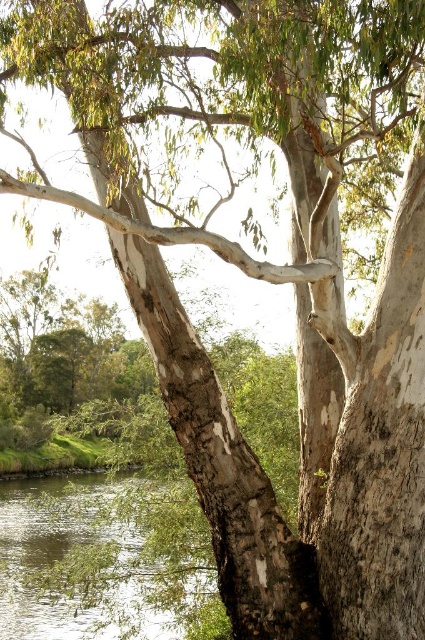
You are a hiker standing at the edge of the forest. You notice the white rough bark tree trunk at center and the clear water at lower left. Which object is taller?

The white rough bark tree trunk at center is taller than the clear water at lower left.

You are a painter setting up your easel to capture the scene of the white rough bark tree trunk at center and the clear water at lower left. You want to ensure the tree trunk is not wider than the water in your painting. Based on the scene, will you need to adjust the tree trunk width in your artwork?

The white rough bark tree trunk at center has a lesser width compared to clear water at lower left, so you do not need to adjust the tree trunk width in your artwork as it already meets the requirement.

You are standing in the forest looking at the large tree. There are two points marked on the ground near the tree. One is at coordinates point (220,394) and the other at point (110,534). Which point is closer to you?

Point (220,394) is in front of point (110,534), so it is closer to you.